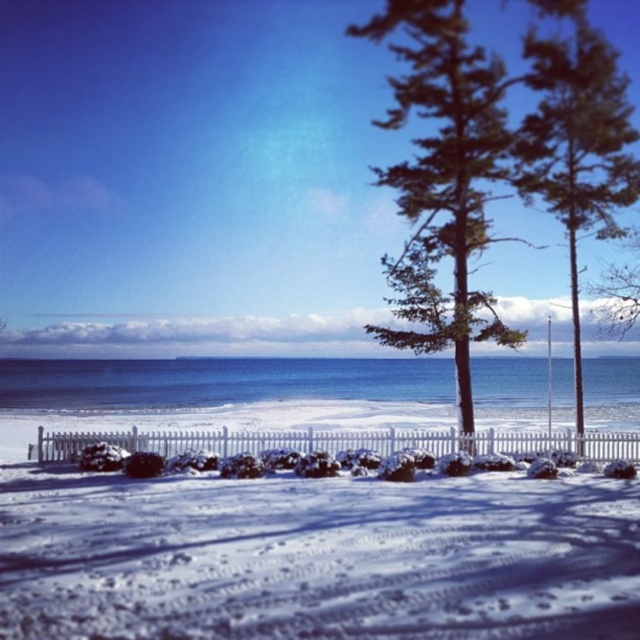
You are standing at the center of the image and want to walk towards the point marked at coordinates point (444,182). Based on the scene description, what type of terrain or object will you encounter at that point?

The point (444,182) is on green needle like foliage at center, so you will encounter green needle like foliage there.

You are an autonomous drone navigating a winter landscape. Your mission is to land precisely at the coordinates given for the white snow at center. Based on the scene description, where should you aim to land?

The white snow at center is located at coordinates point (317, 556), so you should aim to land there.